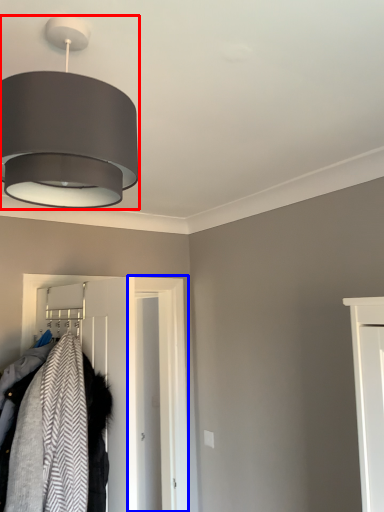
Question: Which of the following is the farthest to the observer, lamp (highlighted by a red box) or door (highlighted by a blue box)?

Choices:
 (A) lamp
 (B) door

Answer: (B)